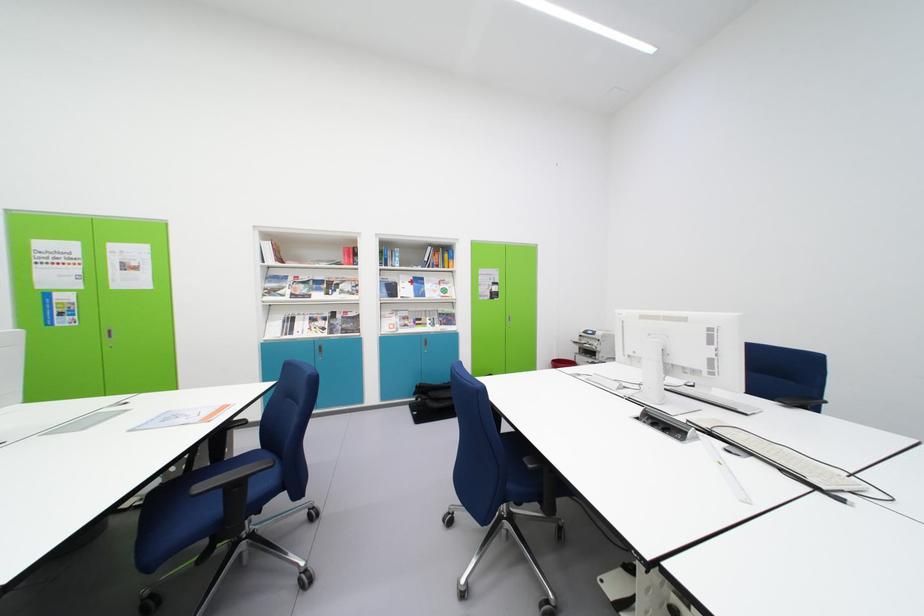
Describe the element at coordinates (232, 477) in the screenshot. I see `a blue chair armrest` at that location.